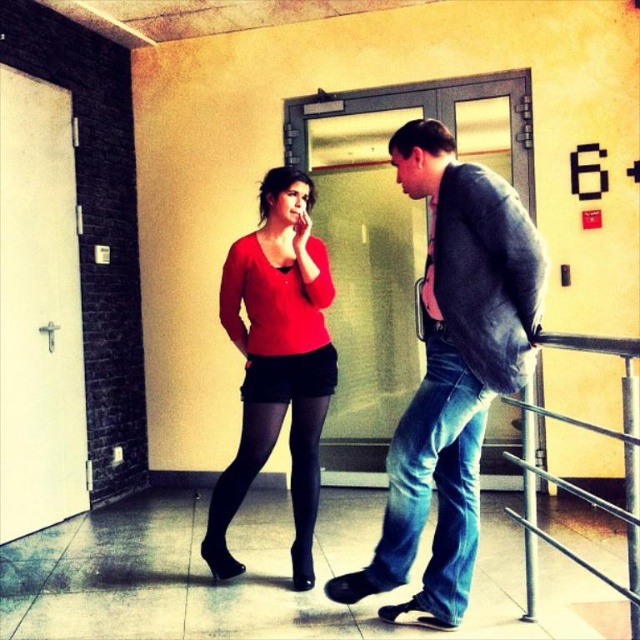
You are a fashion designer analyzing the spatial relationship between the denim jeans at center and the matte red sweater at center in the image. Which item appears taller?

The denim jeans at center appears taller than the matte red sweater at center.

You are an interior designer assessing the hallway. You need to determine if the matte red sweater at center can be placed on the metallic silver railing at lower right without exceeding its space. Can it fit?

The matte red sweater at center occupies less space than the metallic silver railing at lower right, so it can fit on the railing without exceeding its space.